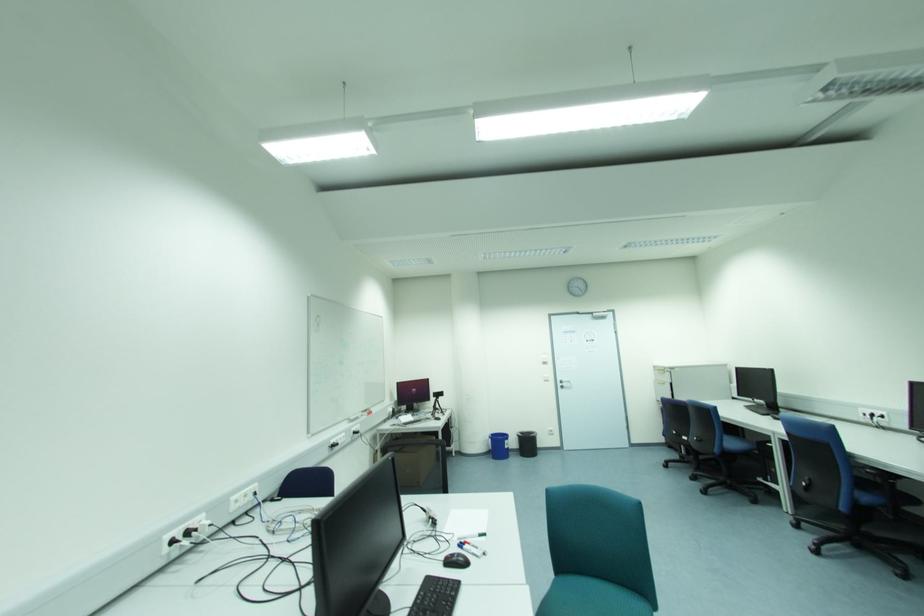
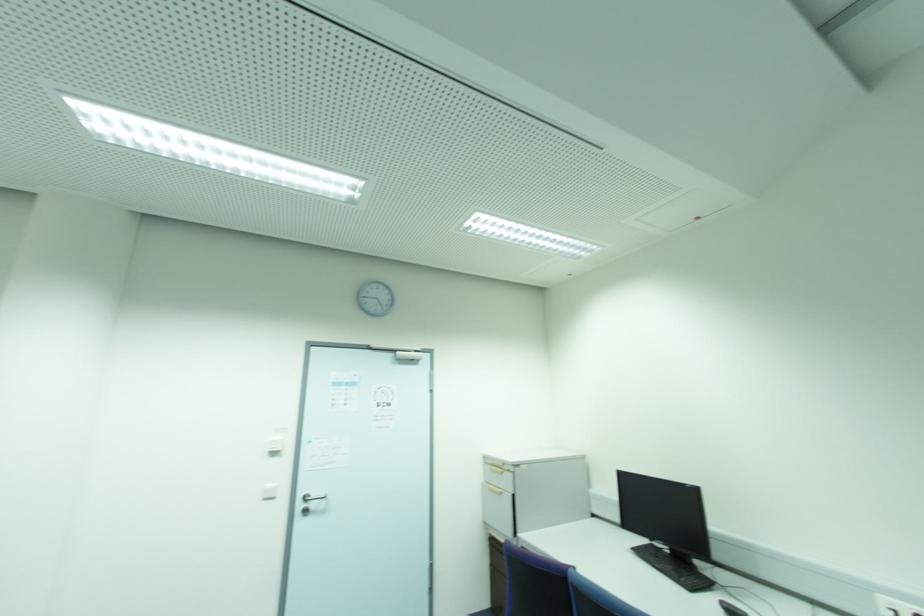
The point at [544,363] is marked in the first image. Where is the corresponding point in the second image?

(274, 454)